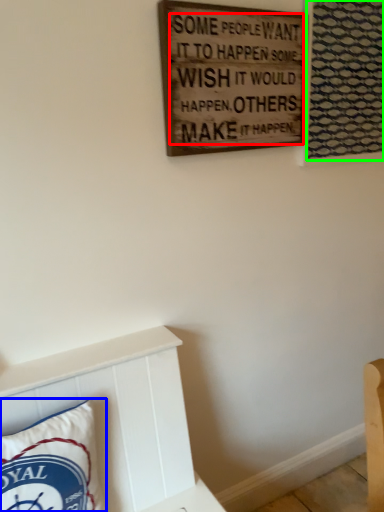
Question: Estimate the real-world distances between objects in this image. Which object is farther from writing (highlighted by a red box), pillow (highlighted by a blue box) or tapestry (highlighted by a green box)?

Choices:
 (A) pillow
 (B) tapestry

Answer: (A)